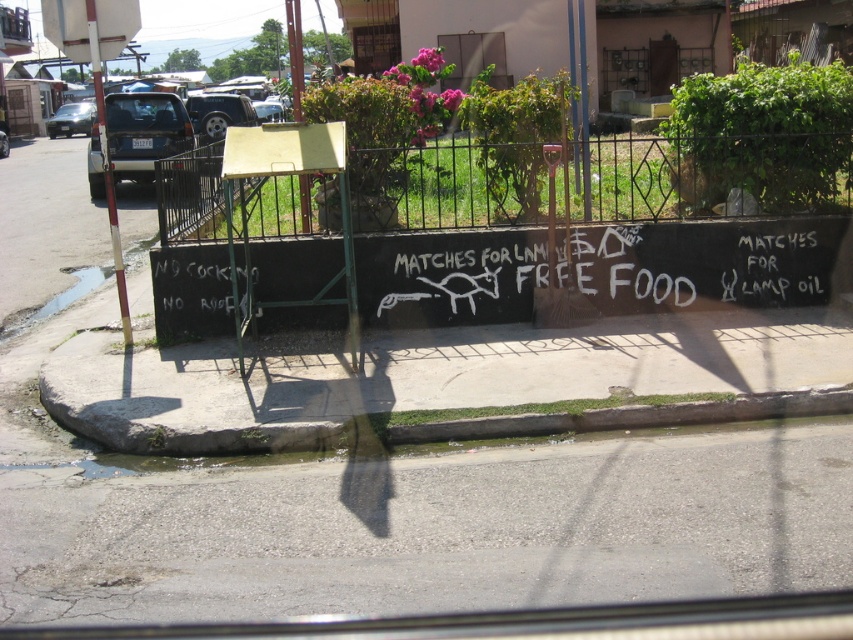
Does point (438, 317) lie behind point (448, 428)?

Yes, it is behind point (448, 428).

Can you confirm if white chalk writing at center is bigger than gray concrete curb at lower center?

Yes, white chalk writing at center is bigger than gray concrete curb at lower center.

At what (x,y) coordinates should I click in order to perform the action: click on white chalk writing at center. Please return your answer as a coordinate pair (x, y). The height and width of the screenshot is (640, 853). Looking at the image, I should click on (706, 262).

How far apart are white chalk writing at center and matte blue suv at left?

They are 8.94 meters apart.

Can you confirm if white chalk writing at center is wider than matte blue suv at left?

Incorrect, white chalk writing at center's width does not surpass matte blue suv at left's.

Is point (283, 262) positioned behind point (167, 100)?

No, it is not.

Where is `white chalk writing at center`? white chalk writing at center is located at coordinates (706, 262).

Does point (222, 200) lie behind point (225, 116)?

No, it is in front of (225, 116).

Is metallic wire fence at center taller than matte black suv at upper left?

No.

Is point (780, 204) positioned before point (228, 109)?

Yes, it is in front of point (228, 109).

This screenshot has width=853, height=640. I want to click on metallic wire fence at center, so click(x=711, y=177).